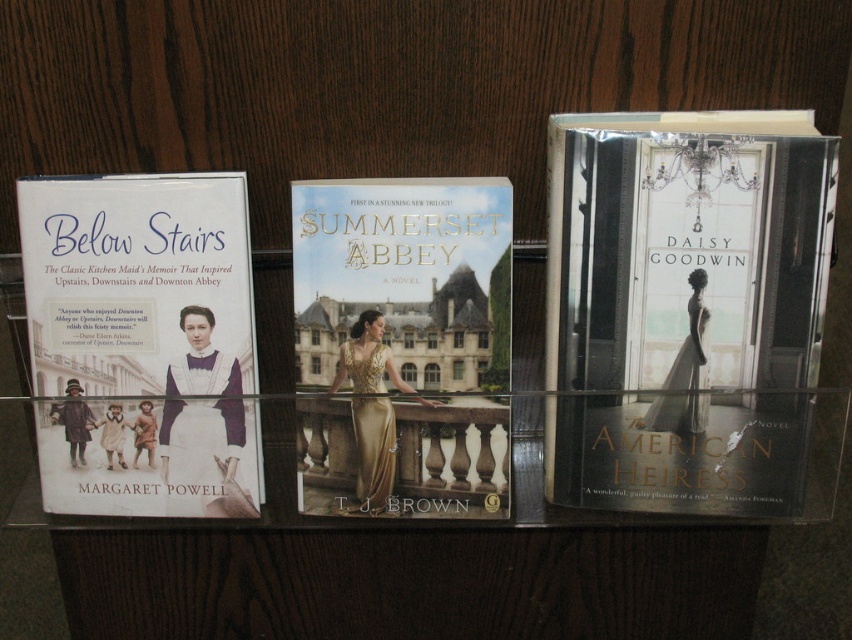
Locate an element on the screen. matte white book at left is located at coordinates (142, 342).

Does matte white book at left appear over gold fabric book at center?

Incorrect, matte white book at left is not positioned above gold fabric book at center.

Find the location of a particular element. The width and height of the screenshot is (852, 640). matte white book at left is located at coordinates (142, 342).

Who is shorter, matte white book at right or gold fabric book at center?

With less height is gold fabric book at center.

Does point (640, 438) come farther from viewer compared to point (415, 216)?

Yes, it is behind point (415, 216).

This screenshot has width=852, height=640. In order to click on matte white book at right in this screenshot , I will do `click(689, 314)`.

Between matte white book at right and matte white book at left, which one has more height?

Standing taller between the two is matte white book at right.

Is point (779, 344) closer to camera compared to point (65, 442)?

Yes.

Which is behind, point (608, 188) or point (151, 374)?

The point (151, 374) is behind.

Image resolution: width=852 pixels, height=640 pixels. In order to click on matte white book at right in this screenshot , I will do click(x=689, y=314).